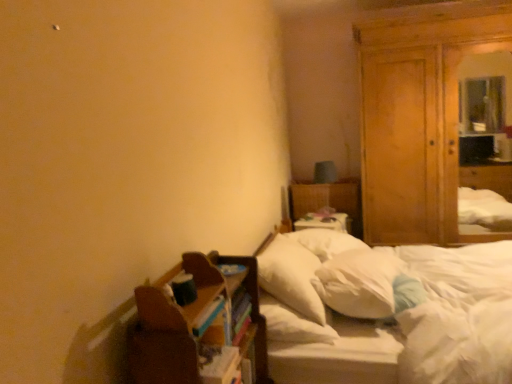
Question: In the image, is white fabric bed at center positioned in front of or behind wooden wardrobe at right?

Choices:
 (A) front
 (B) behind

Answer: (B)

Question: Considering the positions of white fabric bed at center and wooden wardrobe at right in the image, is white fabric bed at center bigger or smaller than wooden wardrobe at right?

Choices:
 (A) big
 (B) small

Answer: (B)

Question: Based on their relative distances, which object is nearer to the multicolored paper book at center?

Choices:
 (A) white soft pillow at center, which ranks as the second pillow in right-to-left order
 (B) white soft pillow at center, arranged as the 1th pillow when viewed from the right
 (C) wooden wardrobe at right
 (D) white soft mattress at center
 (E) brown wooden shelf at lower left

Answer: (E)

Question: Based on their relative distances, which object is nearer to the white soft pillow at center, which ranks as the second pillow in right-to-left order?

Choices:
 (A) brown wooden shelf at lower left
 (B) multicolored paper book at center
 (C) white soft pillow at center, arranged as the 1th pillow when viewed from the right
 (D) wooden wardrobe at right
 (E) white fabric bed at center

Answer: (C)